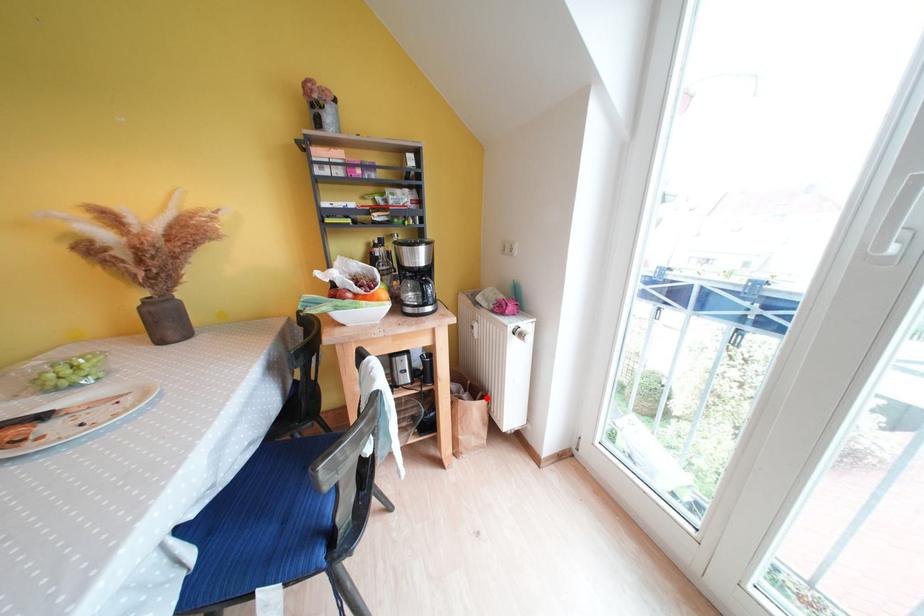
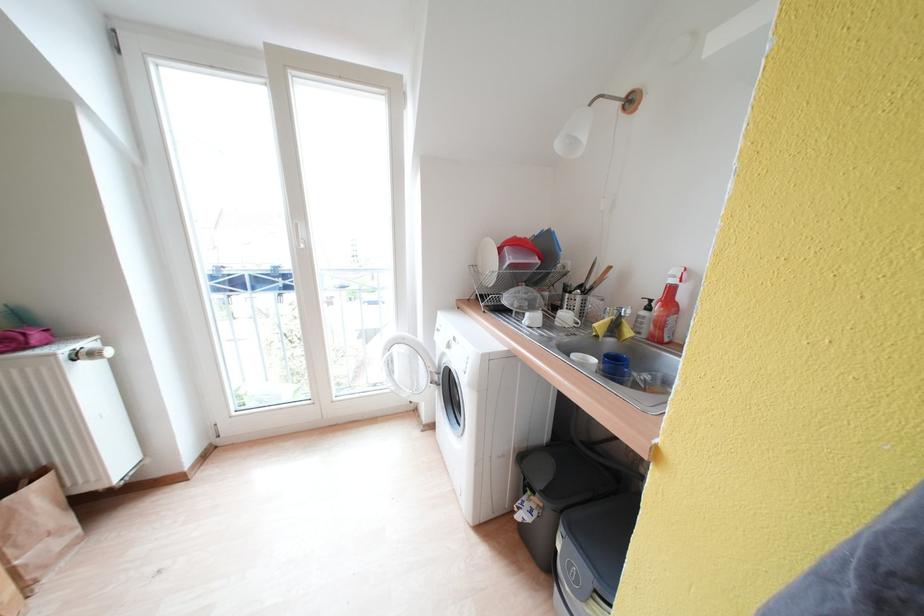
Question: A red point is marked in image1. In image2, is the corresponding 3D point closer to the camera or farther? Reply with the corresponding letter.

Choices:
 (A) The corresponding 3D point is closer.
 (B) The corresponding 3D point is farther.

Answer: (B)